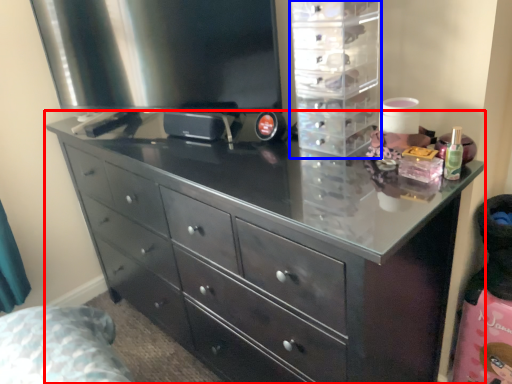
Question: Which of the following is the farthest to the observer, chest of drawers (highlighted by a red box) or cabinet (highlighted by a blue box)?

Choices:
 (A) chest of drawers
 (B) cabinet

Answer: (B)